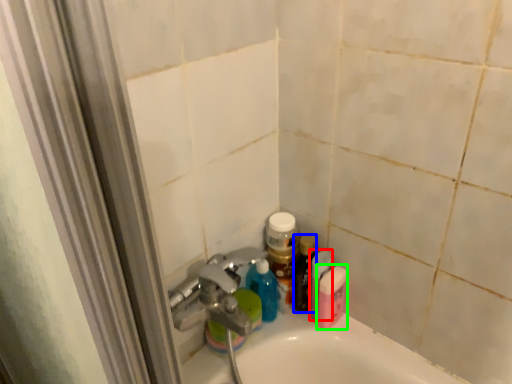
Question: Which object is positioned closest to mouthwash (highlighted by a red box)? Select from toiletry (highlighted by a blue box) and mouthwash (highlighted by a green box).

Choices:
 (A) toiletry
 (B) mouthwash

Answer: (B)